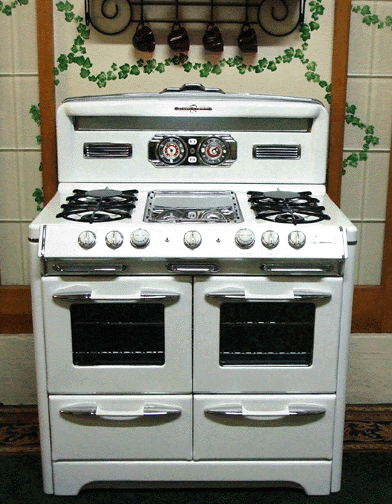
The width and height of the screenshot is (392, 504). Identify the location of oven racks on right side. (269, 323), (272, 351).